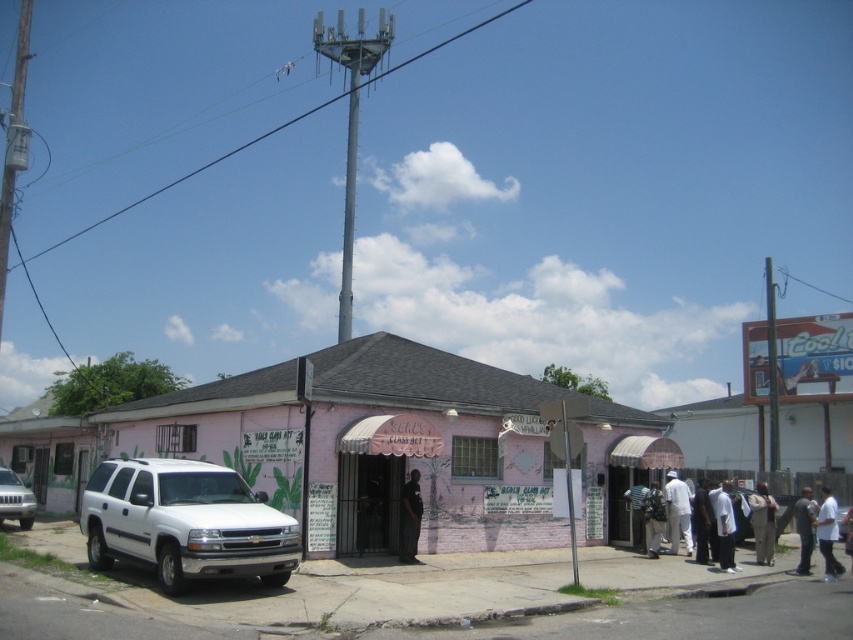
Measure the distance between metallic gray pole at upper center and camera.

The distance of metallic gray pole at upper center from camera is 25.47 meters.

Who is more distant from viewer, (338, 314) or (567, 508)?

The point (338, 314) is behind.

Does point (352, 125) come in front of point (572, 449)?

No.

Image resolution: width=853 pixels, height=640 pixels. Identify the location of metallic gray pole at upper center. (347, 208).

Consider the image. Between dark gray backpack at center and metallic gray pole at center, which one is positioned higher?

metallic gray pole at center is higher up.

Is dark gray backpack at center taller than metallic gray pole at center?

No, dark gray backpack at center is not taller than metallic gray pole at center.

Is point (663, 508) less distant than point (572, 460)?

No, (663, 508) is further to viewer.

Locate an element on the screen. The width and height of the screenshot is (853, 640). dark gray backpack at center is located at coordinates (653, 518).

Describe the element at coordinates (347, 208) in the screenshot. This screenshot has width=853, height=640. I see `metallic gray pole at upper center` at that location.

Is metallic gray pole at upper center thinner than dark gray fabric pants at lower right?

No, metallic gray pole at upper center is not thinner than dark gray fabric pants at lower right.

Measure the distance between metallic gray pole at upper center and camera.

metallic gray pole at upper center and camera are 83.57 feet apart.

Find the location of a particular element. The image size is (853, 640). metallic gray pole at upper center is located at coordinates (347, 208).